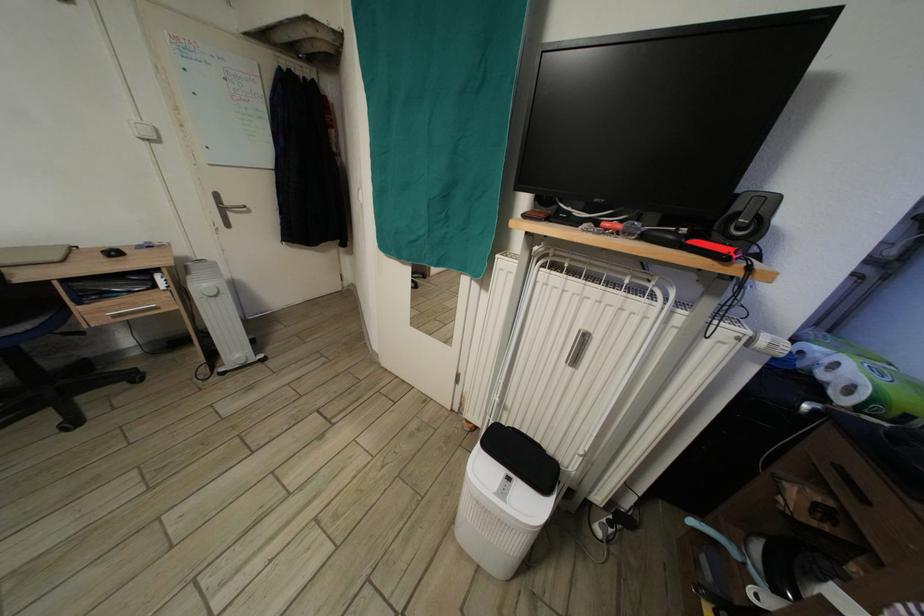
What do you see at coordinates (210, 290) in the screenshot? I see `the radiator thermostat knob` at bounding box center [210, 290].